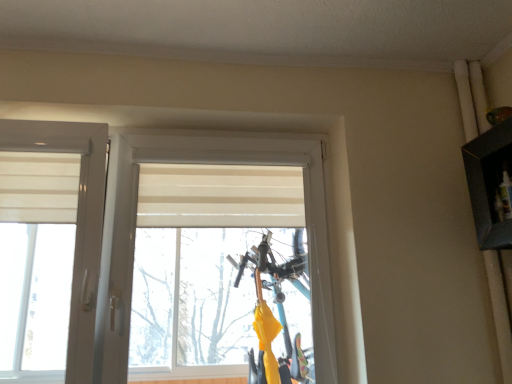
Question: Should I look upward or downward to see white matte window at center?

Choices:
 (A) down
 (B) up

Answer: (A)